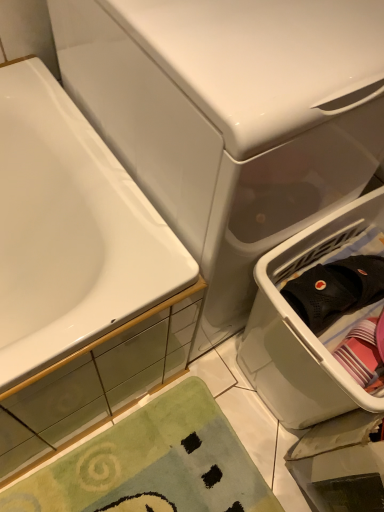
Question: Should I look upward or downward to see white plastic laundry basket at right?

Choices:
 (A) down
 (B) up

Answer: (A)

Question: Is white glossy water tank at upper center in front of white glossy bathtub at left?

Choices:
 (A) yes
 (B) no

Answer: (A)

Question: Is white glossy water tank at upper center at the right side of white glossy bathtub at left?

Choices:
 (A) yes
 (B) no

Answer: (A)

Question: Is white glossy bathtub at left at the back of white glossy water tank at upper center?

Choices:
 (A) yes
 (B) no

Answer: (B)

Question: Is white glossy water tank at upper center facing towards white glossy bathtub at left?

Choices:
 (A) yes
 (B) no

Answer: (B)

Question: Considering the relative sizes of white glossy water tank at upper center and white glossy bathtub at left in the image provided, is white glossy water tank at upper center taller than white glossy bathtub at left?

Choices:
 (A) yes
 (B) no

Answer: (A)

Question: Does white glossy water tank at upper center have a greater width compared to white glossy bathtub at left?

Choices:
 (A) yes
 (B) no

Answer: (B)

Question: Is white plastic laundry basket at right positioned before green plush bath mat at lower left?

Choices:
 (A) no
 (B) yes

Answer: (B)

Question: Considering the relative sizes of white plastic laundry basket at right and green plush bath mat at lower left in the image provided, is white plastic laundry basket at right thinner than green plush bath mat at lower left?

Choices:
 (A) no
 (B) yes

Answer: (A)

Question: Can you confirm if white plastic laundry basket at right is positioned to the left of green plush bath mat at lower left?

Choices:
 (A) yes
 (B) no

Answer: (B)

Question: Can you confirm if white plastic laundry basket at right is positioned to the right of green plush bath mat at lower left?

Choices:
 (A) yes
 (B) no

Answer: (A)

Question: From a real-world perspective, is white plastic laundry basket at right below green plush bath mat at lower left?

Choices:
 (A) yes
 (B) no

Answer: (B)

Question: Considering the relative sizes of white plastic laundry basket at right and green plush bath mat at lower left in the image provided, is white plastic laundry basket at right wider than green plush bath mat at lower left?

Choices:
 (A) no
 (B) yes

Answer: (B)

Question: Is white glossy bathtub at left in contact with white plastic laundry basket at right?

Choices:
 (A) yes
 (B) no

Answer: (B)